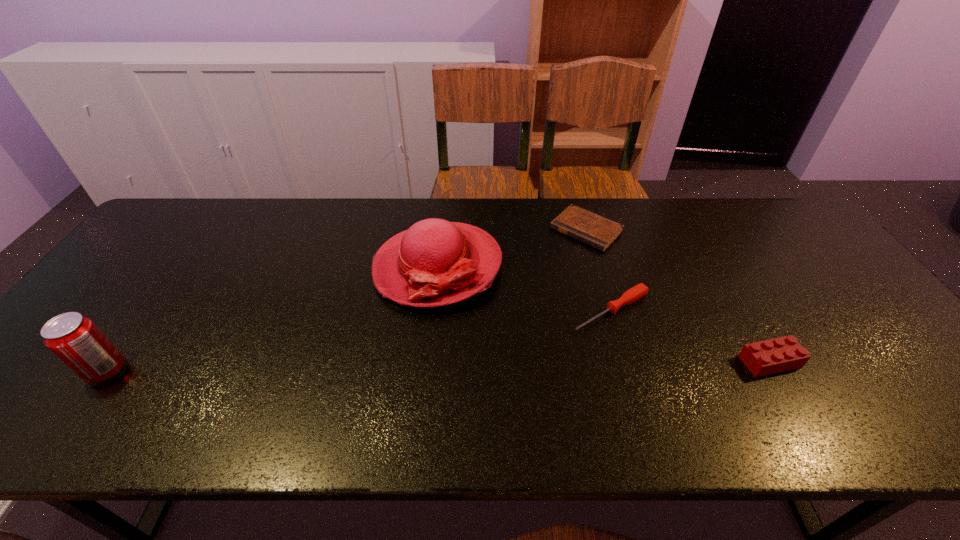
Identify the location of vacant area that satisfies the following two spatial constraints: 1. on the front side of the rightmost object; 2. on the right side of the shortest object. (623, 361).

This screenshot has height=540, width=960. I want to click on vacant region that satisfies the following two spatial constraints: 1. on the back side of the soda; 2. on the left side of the rightmost object, so click(x=113, y=361).

This screenshot has width=960, height=540. Find the location of `free location that satisfies the following two spatial constraints: 1. on the back side of the leftmost object; 2. on the right side of the shortest object`. free location that satisfies the following two spatial constraints: 1. on the back side of the leftmost object; 2. on the right side of the shortest object is located at coordinates (207, 230).